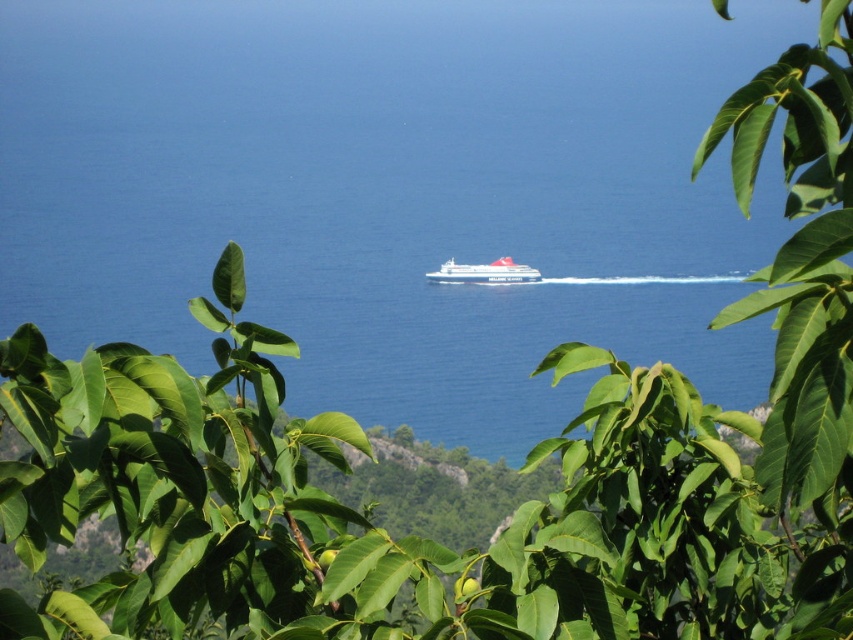
Question: Can you confirm if blue liquid water at center is thinner than white glossy ferry at center?

Choices:
 (A) yes
 (B) no

Answer: (B)

Question: Which point is closer to the camera?

Choices:
 (A) (502, 275)
 (B) (520, 392)

Answer: (A)

Question: Does blue liquid water at center appear on the right side of white glossy ferry at center?

Choices:
 (A) no
 (B) yes

Answer: (A)

Question: Is blue liquid water at center wider than white glossy ferry at center?

Choices:
 (A) yes
 (B) no

Answer: (A)

Question: Among these points, which one is nearest to the camera?

Choices:
 (A) (509, 269)
 (B) (180, 154)

Answer: (A)

Question: Which point is closer to the camera?

Choices:
 (A) (511, 259)
 (B) (354, 188)

Answer: (A)